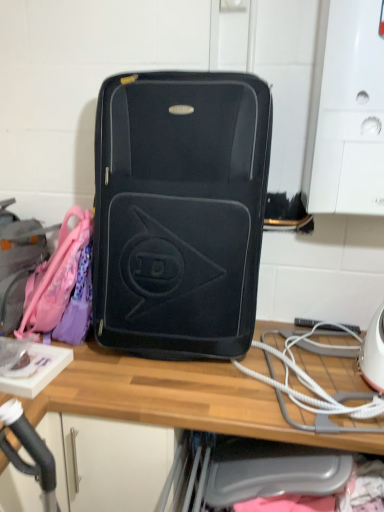
Identify the location of vacant region above wooden desk at center (from a real-world perspective). The image size is (384, 512). (233, 379).